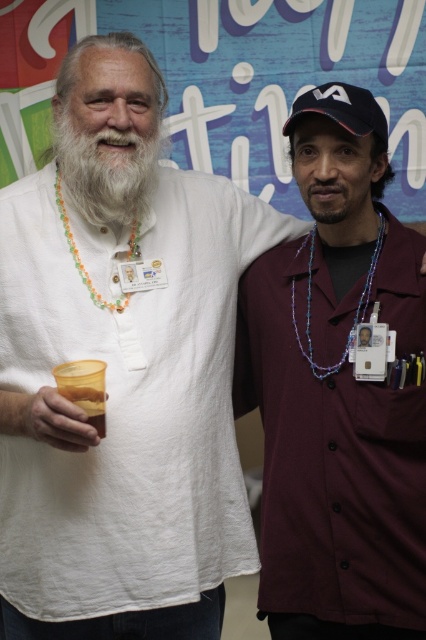
You are standing in front of two people. The first person is on the left wearing a white shirt with a lei and holding a cup. The second person is on the right wearing a maroon button up shirt and a black baseball cap. There is a point at coordinates (337, 397). Which person is this point closest to?

The point at (337, 397) corresponds to the maroon button up shirt at right, so it is closest to the second person on the right.